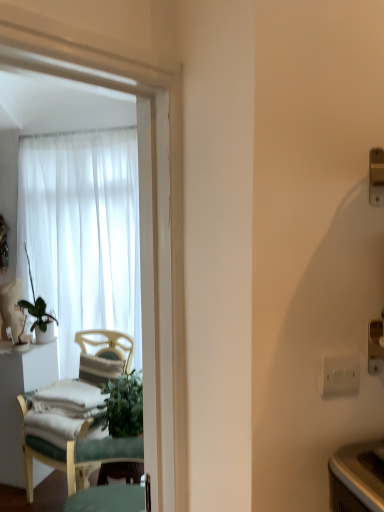
Question: From a real-world perspective, relative to green leafy plant at left, is white plastic electric outlet at right vertically above or below?

Choices:
 (A) below
 (B) above

Answer: (B)

Question: Is white plastic electric outlet at right inside or outside of green leafy plant at left?

Choices:
 (A) outside
 (B) inside

Answer: (A)

Question: Based on their relative distances, which object is nearer to the green fabric chair at left?

Choices:
 (A) white sheer curtain at upper left
 (B) white plastic electric outlet at right
 (C) green leafy plant at left
 (D) white fabric desk at left

Answer: (D)

Question: Estimate the real-world distances between objects in this image. Which object is closer to the white plastic electric outlet at right?

Choices:
 (A) green leafy plant at left
 (B) green fabric chair at left
 (C) white sheer curtain at upper left
 (D) white fabric desk at left

Answer: (B)